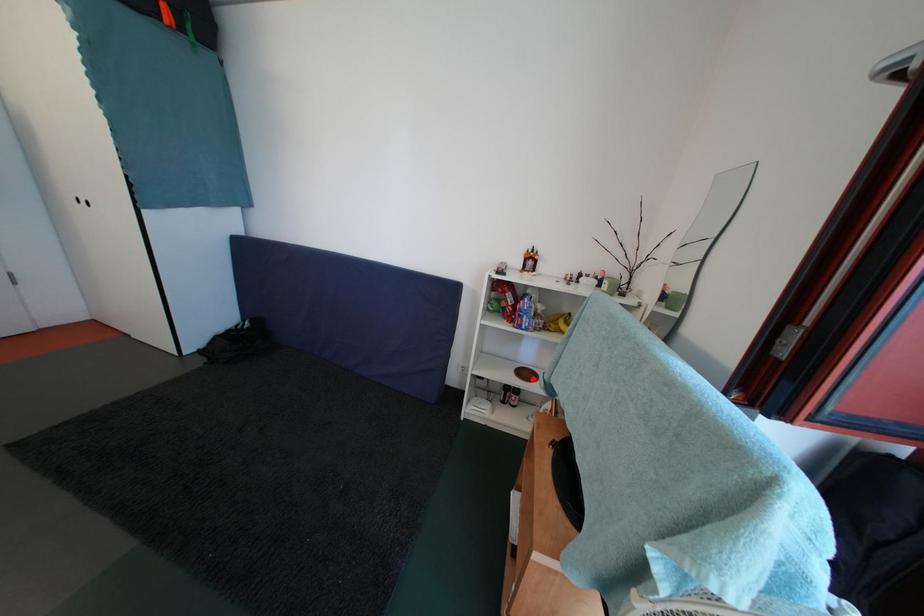
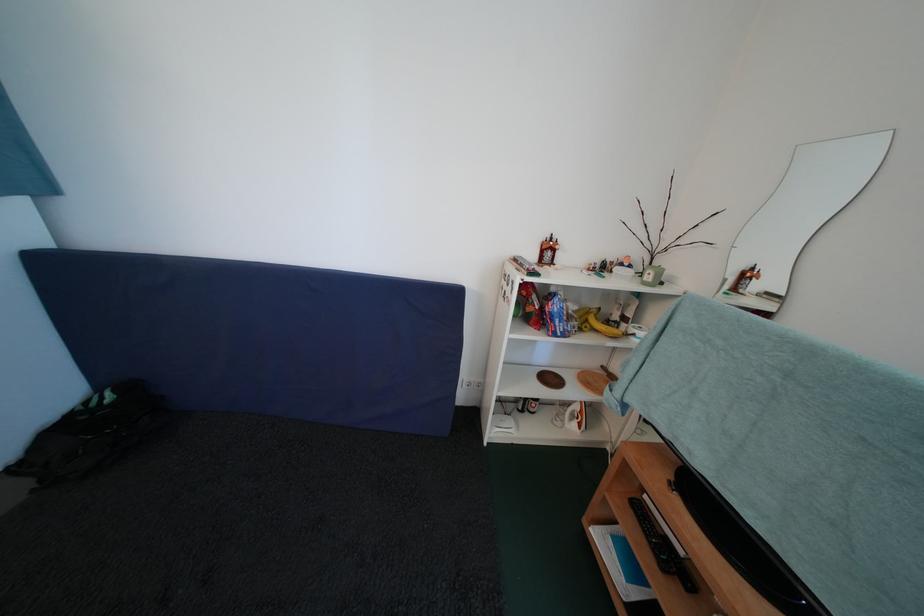
Find the pixel in the second image that matches the highlighted location in the first image.

(556, 384)